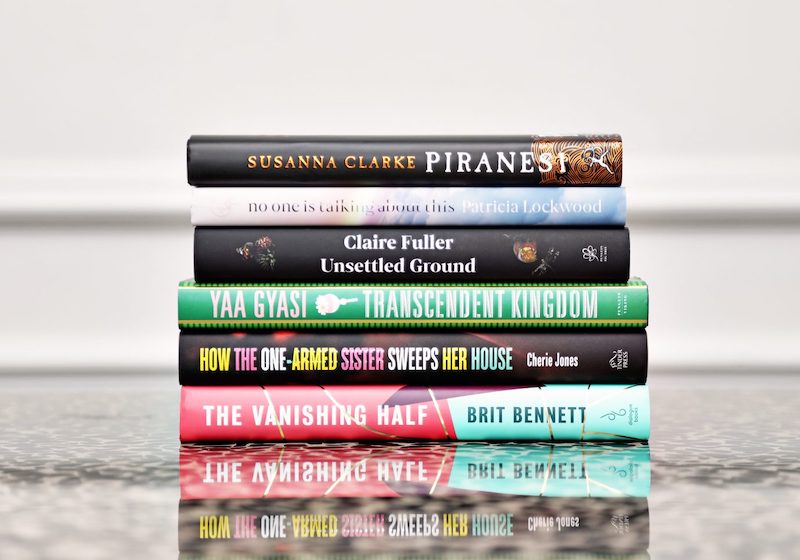
You are a GUI agent. You are given a task and a screenshot of the screen. Output one action in this format:
    pyautogui.click(x=<x>, y=<y>)
    Task: Click on the book
    Image resolution: width=800 pixels, height=560 pixels.
    Given the screenshot: What is the action you would take?
    pyautogui.click(x=534, y=160), pyautogui.click(x=522, y=212), pyautogui.click(x=534, y=249), pyautogui.click(x=520, y=306), pyautogui.click(x=552, y=356), pyautogui.click(x=568, y=405)